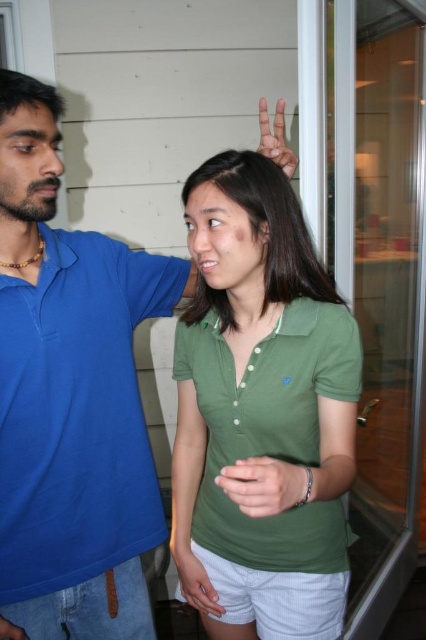
Question: Which object is the closest to the green matte shirt at center?

Choices:
 (A) matte blue hand at upper right
 (B) blue cotton polo shirt at left
 (C) matte green shirt at center

Answer: (B)

Question: Does blue cotton polo shirt at left appear on the left side of matte green wristband at lower center?

Choices:
 (A) no
 (B) yes

Answer: (B)

Question: Is green matte shirt at center positioned at the back of matte green wristband at lower center?

Choices:
 (A) no
 (B) yes

Answer: (A)

Question: Among these points, which one is nearest to the camera?

Choices:
 (A) (230, 493)
 (B) (393, 289)
 (C) (22, 225)

Answer: (A)

Question: Which object is closer to the camera taking this photo?

Choices:
 (A) matte blue hand at upper right
 (B) transparent glass door at center
 (C) blue cotton polo shirt at left
 (D) matte green shirt at center

Answer: (A)

Question: Does blue cotton polo shirt at left have a lesser width compared to blue cotton shirt at left?

Choices:
 (A) yes
 (B) no

Answer: (B)